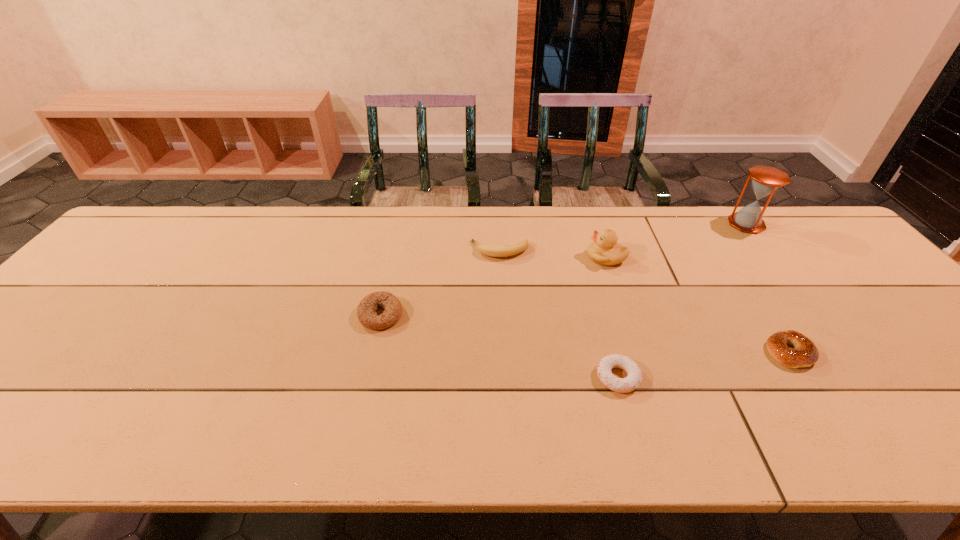
The width and height of the screenshot is (960, 540). I want to click on vacant space that satisfies the following two spatial constraints: 1. at the stem of the second object from left to right; 2. on the back side of the doughnut, so click(x=507, y=377).

You are a GUI agent. You are given a task and a screenshot of the screen. Output one action in this format:
    pyautogui.click(x=<x>, y=<y>)
    Task: Click on the vacant region that satisfies the following two spatial constraints: 1. on the beak of the fifth shortest object; 2. on the right side of the second object from right to left
    The height and width of the screenshot is (540, 960).
    Given the screenshot: What is the action you would take?
    pyautogui.click(x=637, y=352)

The height and width of the screenshot is (540, 960). Find the location of `vacant space that satisfies the following two spatial constraints: 1. at the stem of the second object from left to right; 2. on the front side of the fourth farthest object`. vacant space that satisfies the following two spatial constraints: 1. at the stem of the second object from left to right; 2. on the front side of the fourth farthest object is located at coordinates (503, 315).